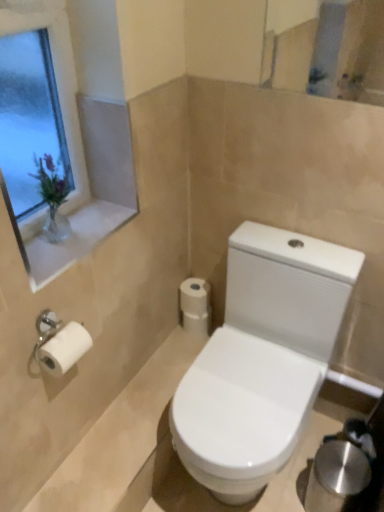
Question: Considering the relative sizes of white glossy window sill at upper left and white glossy toilet at lower center in the image provided, is white glossy window sill at upper left taller than white glossy toilet at lower center?

Choices:
 (A) no
 (B) yes

Answer: (A)

Question: Is white glossy window sill at upper left bigger than white glossy toilet at lower center?

Choices:
 (A) yes
 (B) no

Answer: (B)

Question: Are white glossy window sill at upper left and white glossy toilet at lower center far apart?

Choices:
 (A) yes
 (B) no

Answer: (B)

Question: Is white glossy window sill at upper left wider than white glossy toilet at lower center?

Choices:
 (A) yes
 (B) no

Answer: (B)

Question: Would you say white glossy window sill at upper left is outside white glossy toilet at lower center?

Choices:
 (A) no
 (B) yes

Answer: (B)

Question: Is white glossy window sill at upper left situated inside white matte toilet paper at center or outside?

Choices:
 (A) outside
 (B) inside

Answer: (A)

Question: Considering the positions of white glossy window sill at upper left and white matte toilet paper at center in the image, is white glossy window sill at upper left wider or thinner than white matte toilet paper at center?

Choices:
 (A) thin
 (B) wide

Answer: (B)

Question: In terms of height, does white glossy window sill at upper left look taller or shorter compared to white matte toilet paper at center?

Choices:
 (A) tall
 (B) short

Answer: (B)

Question: From the image's perspective, relative to white matte toilet paper at center, is white glossy window sill at upper left above or below?

Choices:
 (A) below
 (B) above

Answer: (B)

Question: In terms of width, does clear glass vase at upper left look wider or thinner when compared to white glossy toilet at lower center?

Choices:
 (A) thin
 (B) wide

Answer: (A)

Question: From the image's perspective, is clear glass vase at upper left positioned above or below white glossy toilet at lower center?

Choices:
 (A) below
 (B) above

Answer: (B)

Question: Based on their positions, is clear glass vase at upper left located to the left or right of white glossy toilet at lower center?

Choices:
 (A) left
 (B) right

Answer: (A)

Question: In terms of size, does clear glass vase at upper left appear bigger or smaller than white glossy toilet at lower center?

Choices:
 (A) small
 (B) big

Answer: (B)

Question: Is white glossy window sill at upper left wider or thinner than white glossy toilet at lower center?

Choices:
 (A) thin
 (B) wide

Answer: (A)

Question: From the image's perspective, is white glossy window sill at upper left above or below white glossy toilet at lower center?

Choices:
 (A) below
 (B) above

Answer: (B)